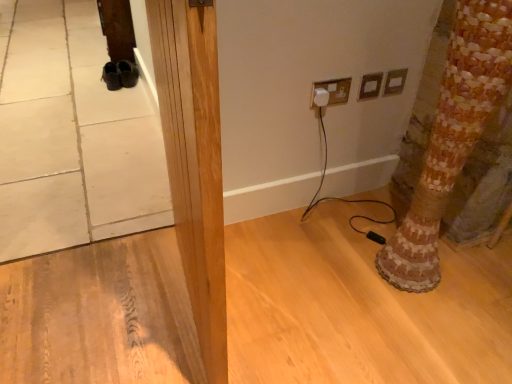
Question: Can you confirm if natural wood pillar at center is positioned to the right of wooden mosaic tree trunk at lower right?

Choices:
 (A) yes
 (B) no

Answer: (B)

Question: Is natural wood pillar at center smaller than wooden mosaic tree trunk at lower right?

Choices:
 (A) no
 (B) yes

Answer: (B)

Question: Can you confirm if natural wood pillar at center is positioned to the left of wooden mosaic tree trunk at lower right?

Choices:
 (A) no
 (B) yes

Answer: (B)

Question: From the image's perspective, is natural wood pillar at center located above wooden mosaic tree trunk at lower right?

Choices:
 (A) yes
 (B) no

Answer: (B)

Question: Considering the relative positions of natural wood pillar at center and wooden mosaic tree trunk at lower right in the image provided, is natural wood pillar at center in front of wooden mosaic tree trunk at lower right?

Choices:
 (A) no
 (B) yes

Answer: (B)

Question: Considering the relative positions of matte plastic outlet at upper right, acting as the 2th electric outlet starting from the left, and white plastic plug at upper center, the 3th electric outlet from the right, in the image provided, is matte plastic outlet at upper right, acting as the 2th electric outlet starting from the left, to the left or to the right of white plastic plug at upper center, the 3th electric outlet from the right,?

Choices:
 (A) left
 (B) right

Answer: (B)

Question: Is matte plastic outlet at upper right, which is the second electric outlet from right to left, inside the boundaries of white plastic plug at upper center, the 3th electric outlet from the right, or outside?

Choices:
 (A) inside
 (B) outside

Answer: (B)

Question: Considering the positions of matte plastic outlet at upper right, which is the second electric outlet from right to left, and white plastic plug at upper center, the 1th electric outlet from the left, in the image, is matte plastic outlet at upper right, which is the second electric outlet from right to left, bigger or smaller than white plastic plug at upper center, the 1th electric outlet from the left,?

Choices:
 (A) big
 (B) small

Answer: (B)

Question: In the image, is matte plastic outlet at upper right, which is the second electric outlet from right to left, positioned in front of or behind white plastic plug at upper center, the 3th electric outlet from the right?

Choices:
 (A) front
 (B) behind

Answer: (B)

Question: Based on their positions, is natural wood pillar at center located to the left or right of matte plastic outlet at upper right, acting as the 2th electric outlet starting from the left?

Choices:
 (A) left
 (B) right

Answer: (A)

Question: Is natural wood pillar at center bigger or smaller than matte plastic outlet at upper right, which is the second electric outlet from right to left?

Choices:
 (A) small
 (B) big

Answer: (B)

Question: Is natural wood pillar at center in front of or behind matte plastic outlet at upper right, acting as the 2th electric outlet starting from the left, in the image?

Choices:
 (A) front
 (B) behind

Answer: (A)

Question: From the image's perspective, is natural wood pillar at center located above or below matte plastic outlet at upper right, acting as the 2th electric outlet starting from the left?

Choices:
 (A) above
 (B) below

Answer: (B)

Question: From the image's perspective, is natural wood pillar at center positioned above or below white plastic plug at upper center, the 1th electric outlet from the left?

Choices:
 (A) below
 (B) above

Answer: (A)

Question: Considering their positions, is natural wood pillar at center located in front of or behind white plastic plug at upper center, the 1th electric outlet from the left?

Choices:
 (A) behind
 (B) front

Answer: (B)